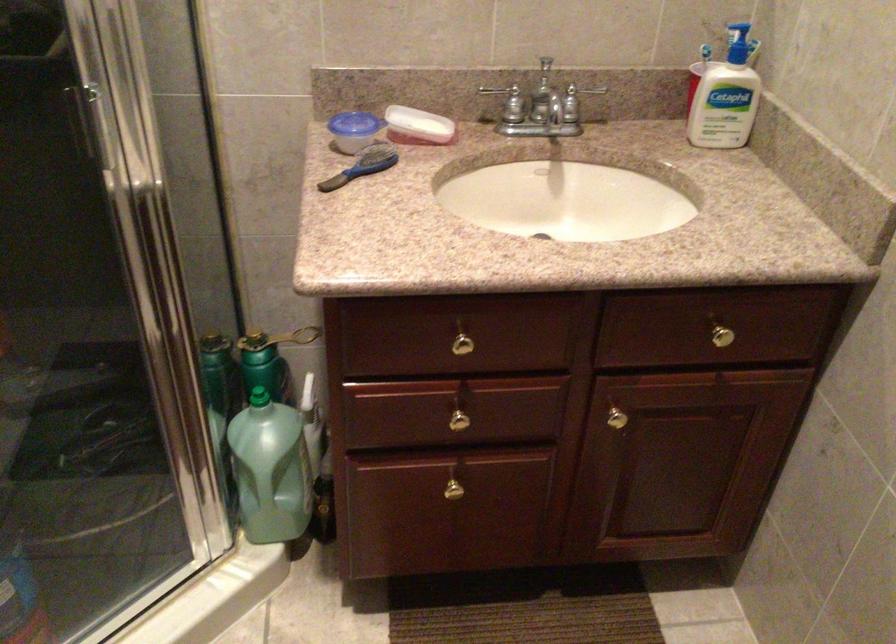
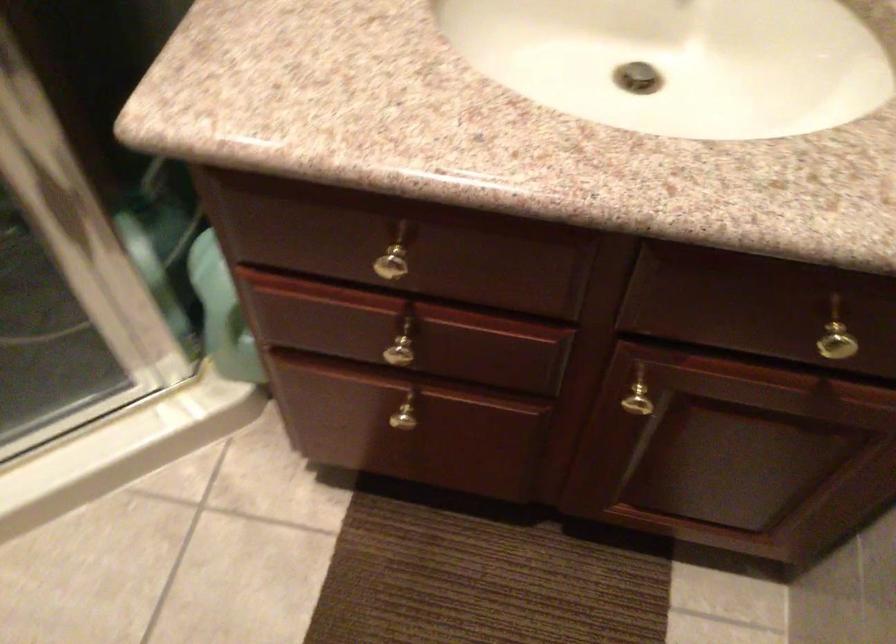
Where in the second image is the point corresponding to the point at 616,415 from the first image?

(640, 399)